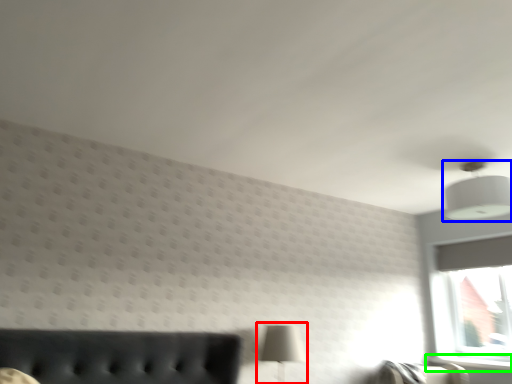
Question: Estimate the real-world distances between objects in this image. Which object is closer to table lamp (highlighted by a red box), lamp (highlighted by a blue box) or window sill (highlighted by a green box)?

Choices:
 (A) lamp
 (B) window sill

Answer: (A)